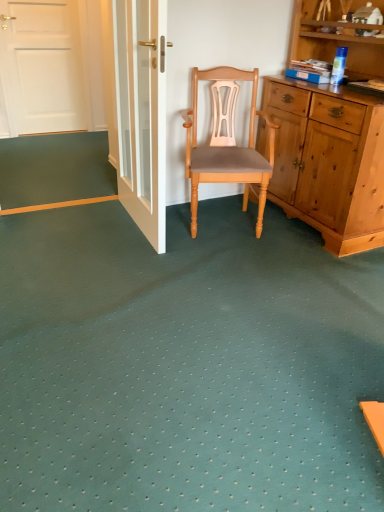
Where is `free location in front of white glossy door at upper center`? This screenshot has width=384, height=512. free location in front of white glossy door at upper center is located at coordinates (129, 266).